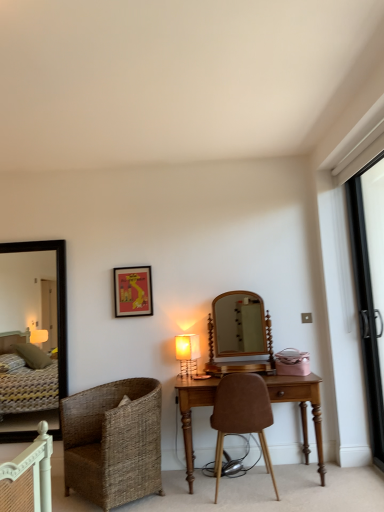
Where is `vacant space situated above black wooden mirror at left (from a real-world perspective)`? vacant space situated above black wooden mirror at left (from a real-world perspective) is located at coordinates (36, 237).